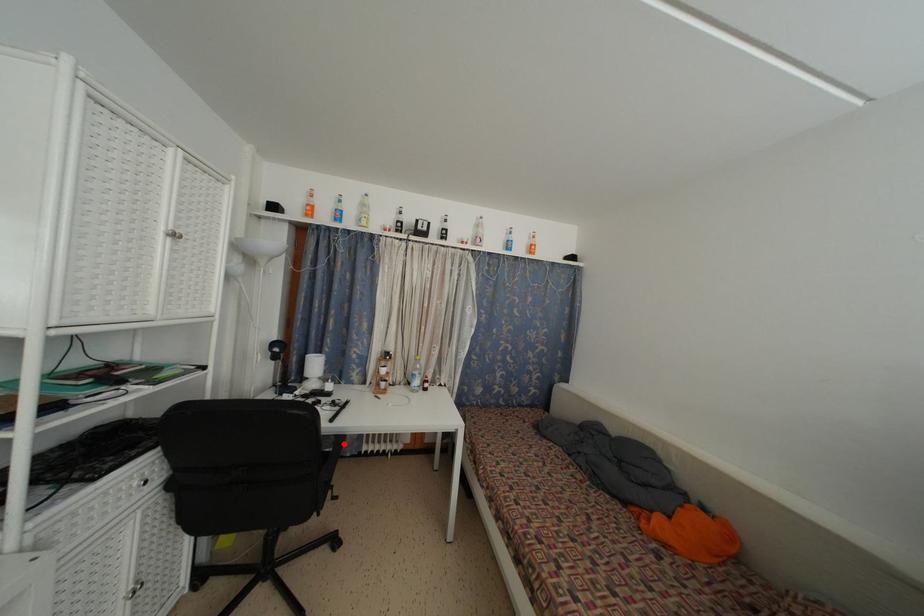
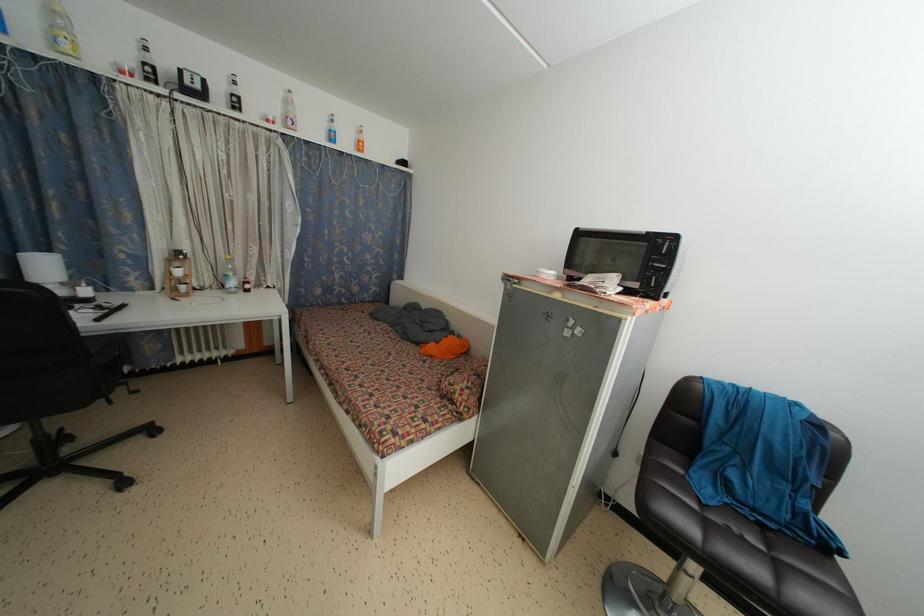
Locate, in the second image, the point that corresponds to the highlighted location in the first image.

(127, 345)